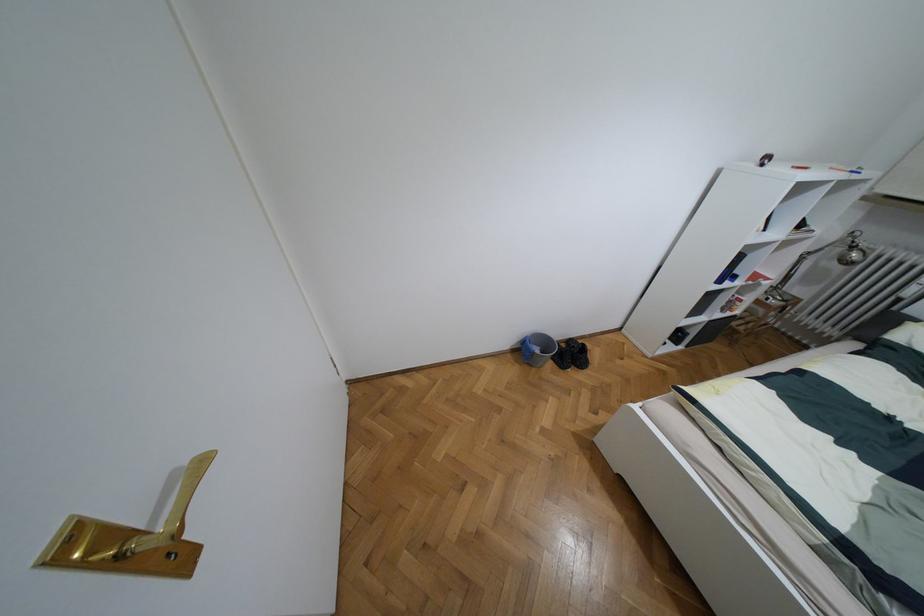
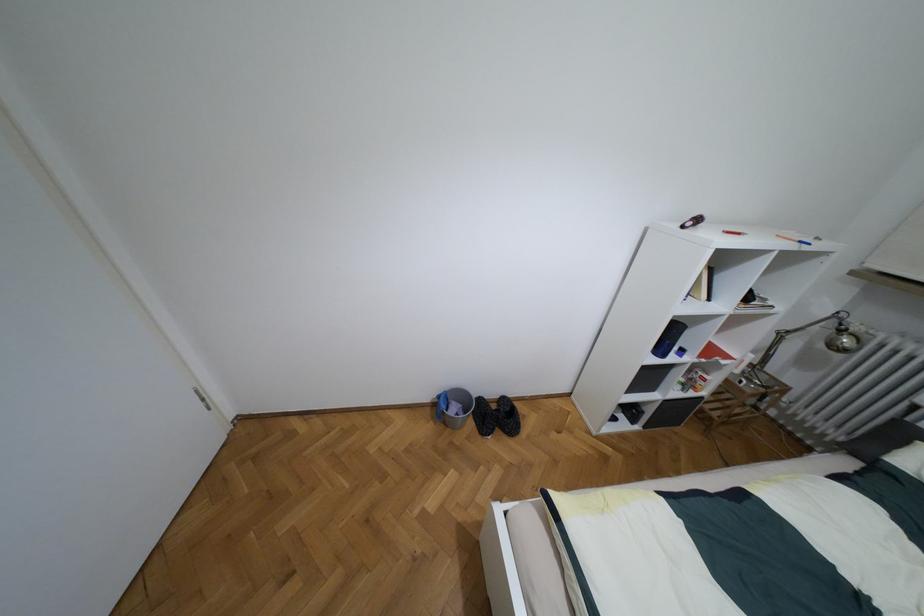
Question: Which direction would the cameraman need to move to produce the second image? Reply with the corresponding letter.

Choices:
 (A) Left
 (B) Right
 (C) Forward
 (D) Backward

Answer: (B)